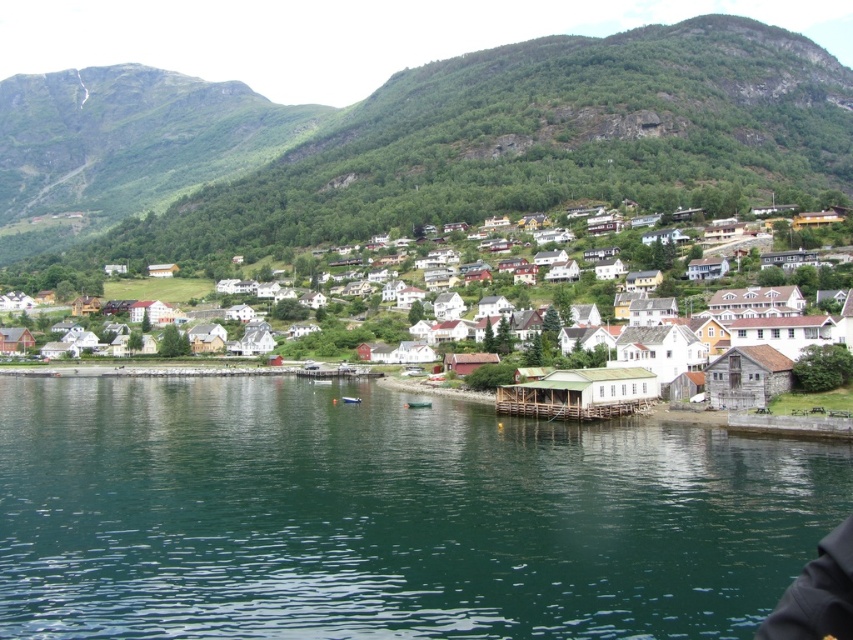
This screenshot has width=853, height=640. What do you see at coordinates (421, 140) in the screenshot?
I see `green grassy hillside at upper center` at bounding box center [421, 140].

Is point (691, 129) positioned in front of point (339, 342)?

That is False.

Find the location of `green grassy hillside at upper center`. green grassy hillside at upper center is located at coordinates [421, 140].

Who is lower down, green water at lower center or white wooden houses at lower right?

Positioned lower is green water at lower center.

Based on the photo, between green water at lower center and white wooden houses at lower right, which one appears on the left side from the viewer's perspective?

green water at lower center

The width and height of the screenshot is (853, 640). In order to click on green water at lower center in this screenshot , I will do `click(386, 515)`.

Does green water at lower center appear over green grassy hillside at upper center?

Incorrect, green water at lower center is not positioned above green grassy hillside at upper center.

Does green water at lower center have a larger size compared to green grassy hillside at upper center?

Actually, green water at lower center might be smaller than green grassy hillside at upper center.

Which is in front, point (397, 513) or point (618, 113)?

Positioned in front is point (397, 513).

Locate an element on the screen. This screenshot has width=853, height=640. green water at lower center is located at coordinates (386, 515).